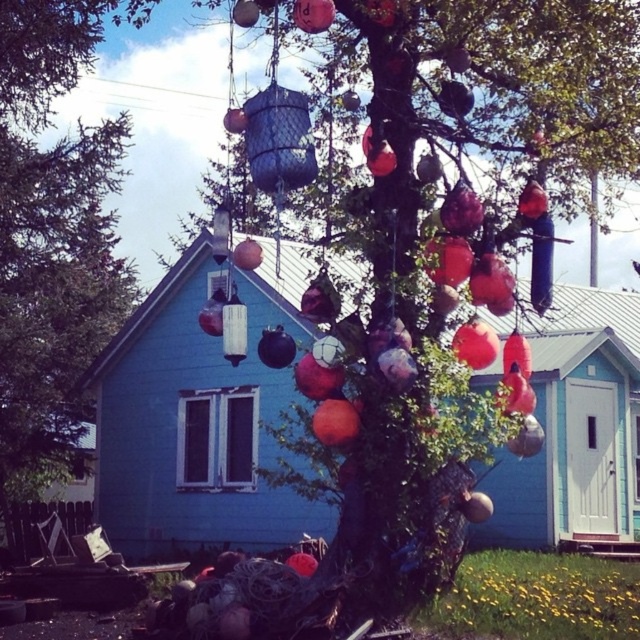
You are standing in front of the light blue wooden house with white trim. You see the metallic mesh basket at center and the green matte tree at center. Which object is closer to you?

The metallic mesh basket at center is closer to you because it is in front of the green matte tree at center.

In the scene shown: You are standing in front of the light blue wooden house with white trim and want to place a new decorative item between the metallic mesh basket at center and the green matte tree at center. Based on their positions, which object should you place it closer to if you want it to be on the left side of the tree?

The metallic mesh basket at center is positioned on the right side of green matte tree at center. To place the new decorative item on the left side of the tree, you should place it closer to the green matte tree at center since it is already on the left relative to the basket.